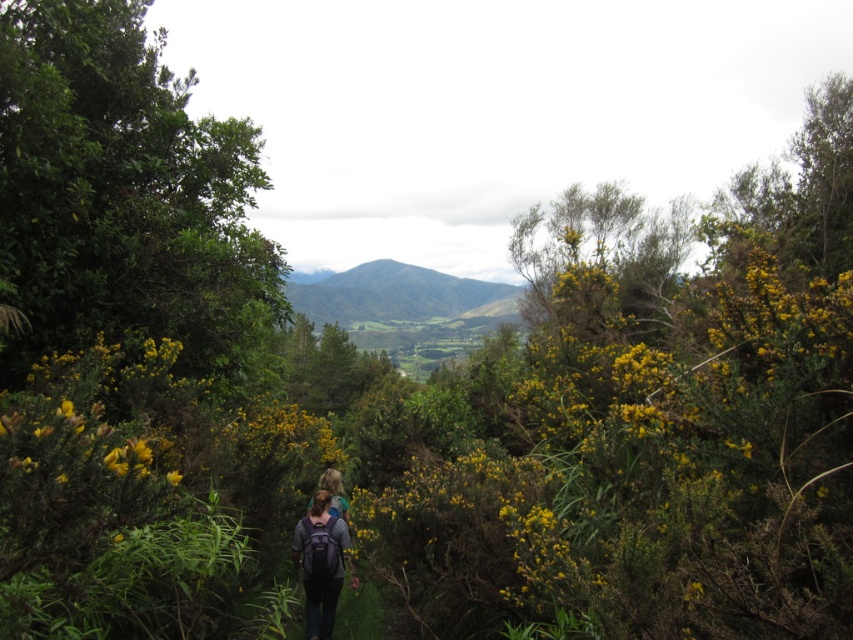
You are a hiker trying to reach the mountain range in the distance. You notice a green leafy bush at upper left and a matte purple backpack at center. Which object is closer to you as you look towards the mountains?

The green leafy bush at upper left is closer to you because it is in front of the matte purple backpack at center, which means it is positioned nearer to your viewpoint.

You are a hiker trying to navigate through the dense vegetation on the path. You see the point marked at coordinates [397,296]. What does this point indicate in the scene?

The point at coordinates [397,296] indicates a green grassy hillside at center.